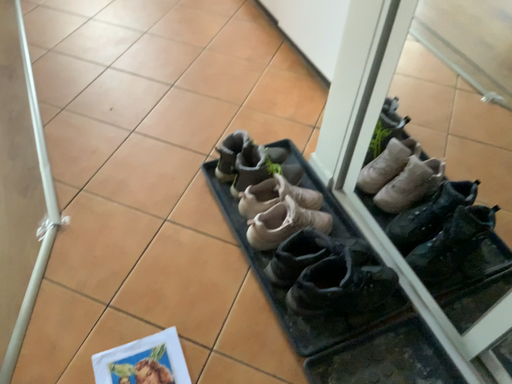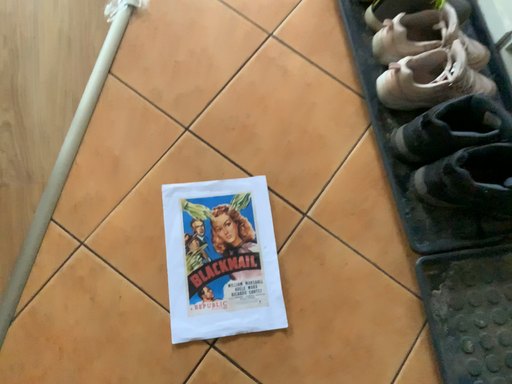
Question: How did the camera likely rotate when shooting the video?

Choices:
 (A) rotated left
 (B) rotated right

Answer: (A)